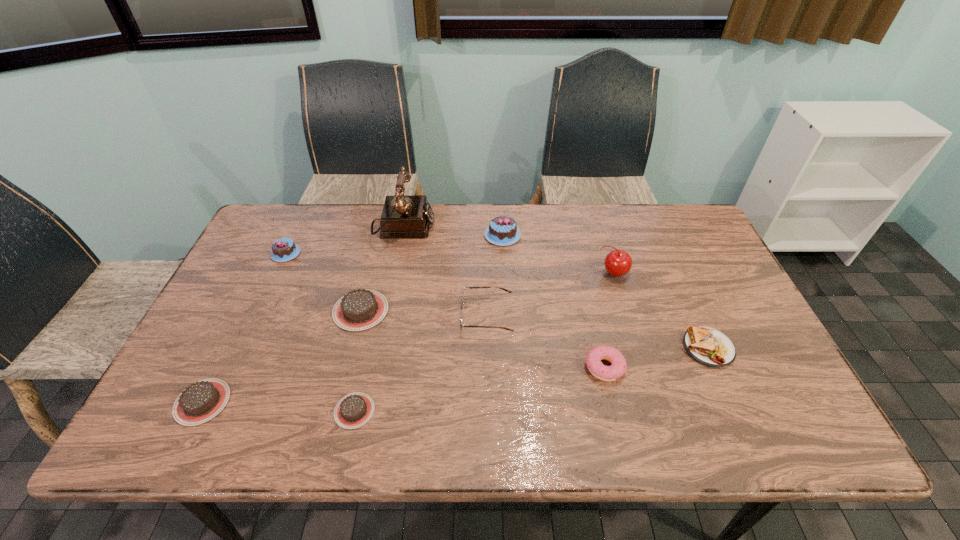
This screenshot has height=540, width=960. Find the location of `free point located on the front of the rightmost chocolate cake`. free point located on the front of the rightmost chocolate cake is located at coordinates (507, 315).

Locate an element on the screen. vacant space situated 0.080m on the left of the left pink chocolate cake is located at coordinates point(246,253).

Locate an element on the screen. vacant position located 0.220m on the front-facing side of the spectacles is located at coordinates (x=378, y=316).

The width and height of the screenshot is (960, 540). In order to click on vacant position located 0.060m on the front-facing side of the spectacles in this screenshot , I will do `click(438, 316)`.

You are a GUI agent. You are given a task and a screenshot of the screen. Output one action in this format:
    pyautogui.click(x=<x>, y=<y>)
    Task: Click on the blank space located on the front-facing side of the spectacles
    The width and height of the screenshot is (960, 540).
    Given the screenshot: What is the action you would take?
    pyautogui.click(x=312, y=316)

This screenshot has height=540, width=960. I want to click on vacant area located 0.150m on the right of the farthest brown chocolate cake, so click(x=443, y=310).

This screenshot has height=540, width=960. I want to click on vacant space located on the front of the doughnut, so click(620, 437).

The width and height of the screenshot is (960, 540). What are the coordinates of `free location located on the back of the sandwich` in the screenshot? It's located at (669, 261).

Locate an element on the screen. free region located 0.090m on the back of the second biggest brown chocolate cake is located at coordinates (228, 348).

The height and width of the screenshot is (540, 960). I want to click on free space located 0.310m on the right of the smallest brown chocolate cake, so click(x=512, y=411).